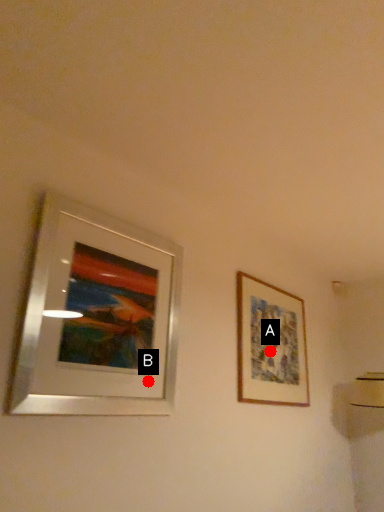
Question: Two points are circled on the image, labeled by A and B beside each circle. Which point is farther to the camera?

Choices:
 (A) A is further
 (B) B is further

Answer: (A)